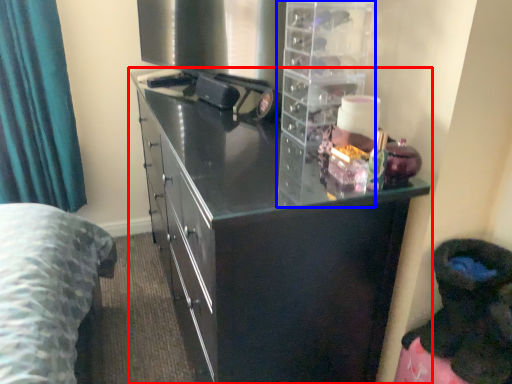
Question: Which point is further to the camera, cupboard (highlighted by a red box) or cabinet (highlighted by a blue box)?

Choices:
 (A) cupboard
 (B) cabinet

Answer: (B)